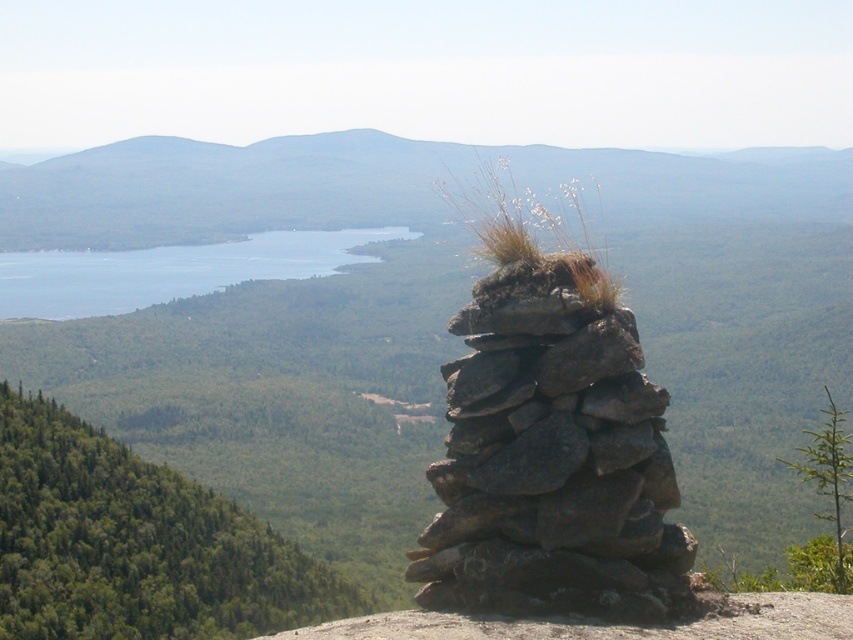
Which is below, rocky outcrop at center or blue water at center?

blue water at center

Looking at this image, which is above, rocky outcrop at center or blue water at center?

Positioned higher is rocky outcrop at center.

Does point (383, 186) come in front of point (86, 253)?

No, (383, 186) is further to viewer.

What are the coordinates of `rocky outcrop at center` in the screenshot? It's located at (381, 186).

Is point (630, 355) positioned after point (61, 282)?

That is False.

Which is in front, point (482, 492) or point (44, 272)?

Point (482, 492) is in front.

Which is in front, point (517, 342) or point (357, 243)?

Point (517, 342) is more forward.

Find the location of a particular element. gray rough stone stack at center is located at coordinates (550, 460).

Who is lower down, gray rough stone stack at center or rocky outcrop at center?

gray rough stone stack at center

Based on the photo, measure the distance between point [616,412] and camera.

A distance of 6.40 meters exists between point [616,412] and camera.

At what (x,y) coordinates should I click in order to perform the action: click on gray rough stone stack at center. Please return your answer as a coordinate pair (x, y). The width and height of the screenshot is (853, 640). Looking at the image, I should click on (550, 460).